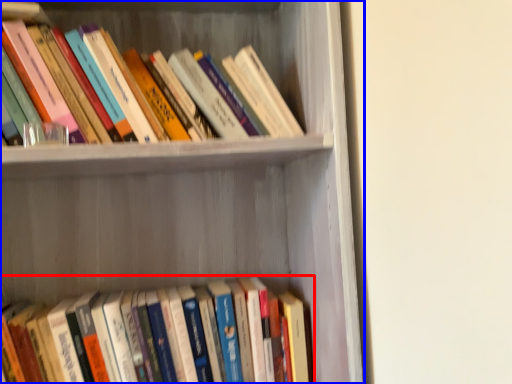
Question: Which object appears farthest to the camera in this image, book (highlighted by a red box) or shelf (highlighted by a blue box)?

Choices:
 (A) book
 (B) shelf

Answer: (A)